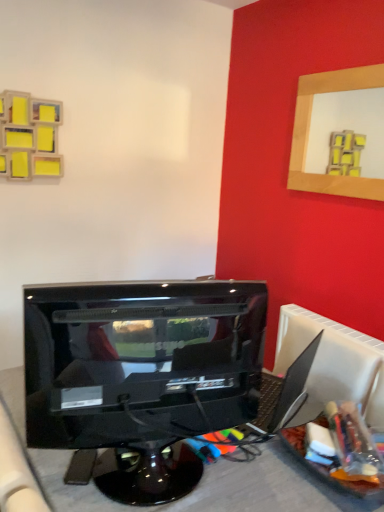
Question: From a real-world perspective, relative to wooden picture frame at upper right, is glossy black monitor at center vertically above or below?

Choices:
 (A) below
 (B) above

Answer: (A)

Question: From the image's perspective, is glossy black monitor at center located above or below wooden picture frame at upper right?

Choices:
 (A) below
 (B) above

Answer: (A)

Question: Is glossy black monitor at center in front of or behind wooden picture frame at upper right in the image?

Choices:
 (A) front
 (B) behind

Answer: (A)

Question: Is wooden picture frame at upper right taller or shorter than glossy black monitor at center?

Choices:
 (A) tall
 (B) short

Answer: (A)

Question: Would you say wooden picture frame at upper right is inside or outside glossy black monitor at center?

Choices:
 (A) outside
 (B) inside

Answer: (A)

Question: From the image's perspective, is wooden picture frame at upper right located above or below glossy black monitor at center?

Choices:
 (A) below
 (B) above

Answer: (B)

Question: In the image, is wooden picture frame at upper right positioned in front of or behind glossy black monitor at center?

Choices:
 (A) front
 (B) behind

Answer: (B)